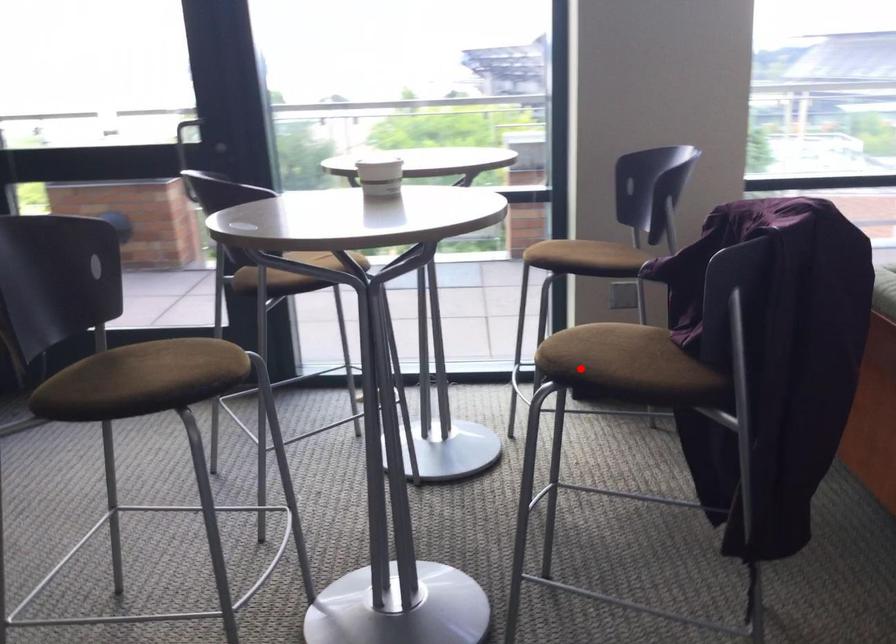
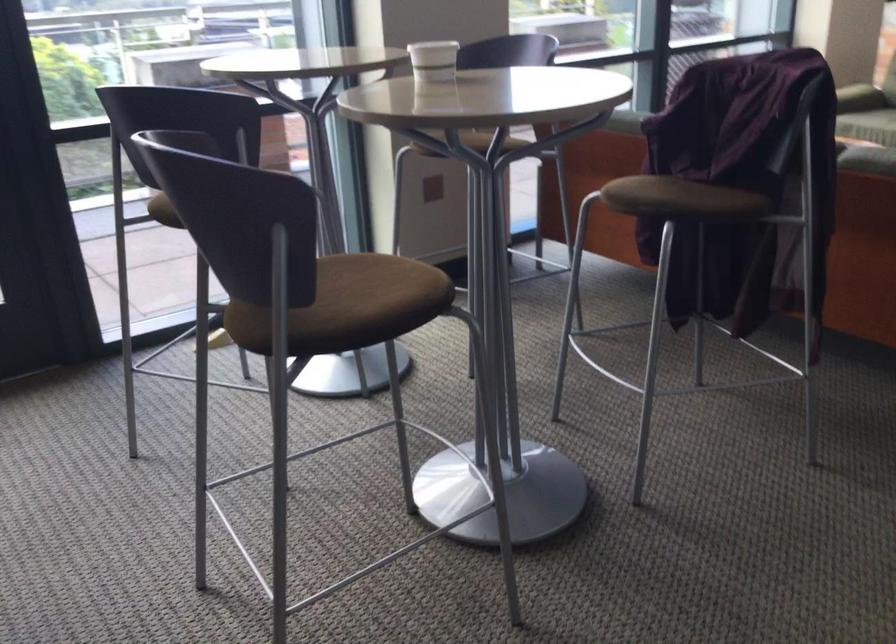
In the second image, find the point that corresponds to the highlighted location in the first image.

(666, 198)